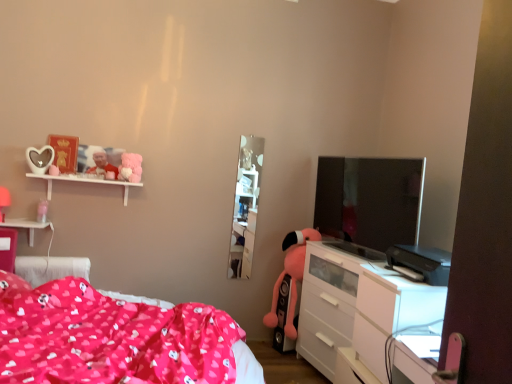
Question: Does fluffy pink plush at upper left, the second toy positioned from the right, appear on the right side of matte plastic photo frame at upper left, placed as the third toy when sorted from right to left?

Choices:
 (A) no
 (B) yes

Answer: (B)

Question: Is the depth of fluffy pink plush at upper left, which ranks as the 2th toy in top-to-bottom order, less than that of matte plastic photo frame at upper left, placed as the 1th toy when sorted from top to bottom?

Choices:
 (A) yes
 (B) no

Answer: (A)

Question: Is fluffy pink plush at upper left, the second toy positioned from the right, shorter than matte plastic photo frame at upper left, placed as the 1th toy when sorted from top to bottom?

Choices:
 (A) no
 (B) yes

Answer: (B)

Question: Could you tell me if fluffy pink plush at upper left, the second toy positioned from the right, is turned towards matte plastic photo frame at upper left, the first toy when ordered from left to right?

Choices:
 (A) yes
 (B) no

Answer: (B)

Question: Is fluffy pink plush at upper left, which ranks as the second toy in bottom-to-top order, placed right next to matte plastic photo frame at upper left, placed as the third toy when sorted from right to left?

Choices:
 (A) yes
 (B) no

Answer: (B)

Question: Is white matte shelf at upper left in front of or behind fluffy pink plush at upper left, which ranks as the second toy in bottom-to-top order, in the image?

Choices:
 (A) behind
 (B) front

Answer: (B)

Question: Is white matte shelf at upper left situated inside fluffy pink plush at upper left, which ranks as the second toy in bottom-to-top order, or outside?

Choices:
 (A) inside
 (B) outside

Answer: (B)

Question: Would you say white matte shelf at upper left is to the left or to the right of fluffy pink plush at upper left, which ranks as the second toy in bottom-to-top order, in the picture?

Choices:
 (A) left
 (B) right

Answer: (A)

Question: Looking at the image, does white matte shelf at upper left seem bigger or smaller compared to fluffy pink plush at upper left, which ranks as the 2th toy in left-to-right order?

Choices:
 (A) big
 (B) small

Answer: (A)

Question: From the image's perspective, is white glossy chest of drawers at lower right above or below white matte shelf at upper left?

Choices:
 (A) below
 (B) above

Answer: (A)

Question: From their relative heights in the image, would you say white glossy chest of drawers at lower right is taller or shorter than white matte shelf at upper left?

Choices:
 (A) short
 (B) tall

Answer: (B)

Question: Relative to white matte shelf at upper left, is white glossy chest of drawers at lower right in front or behind?

Choices:
 (A) front
 (B) behind

Answer: (A)

Question: Is white glossy chest of drawers at lower right inside or outside of white matte shelf at upper left?

Choices:
 (A) inside
 (B) outside

Answer: (B)

Question: In terms of width, does white glossy tv cabinet at center look wider or thinner when compared to fluffy pink plush at upper left, which ranks as the 2th toy in top-to-bottom order?

Choices:
 (A) wide
 (B) thin

Answer: (B)

Question: Visually, is white glossy tv cabinet at center positioned to the left or to the right of fluffy pink plush at upper left, which ranks as the 2th toy in left-to-right order?

Choices:
 (A) right
 (B) left

Answer: (A)